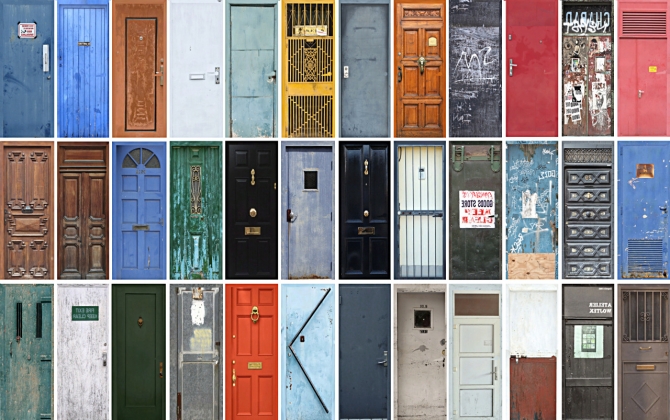
Where is `green door`? The image size is (670, 420). green door is located at coordinates (135, 356), (202, 231), (17, 354), (252, 84).